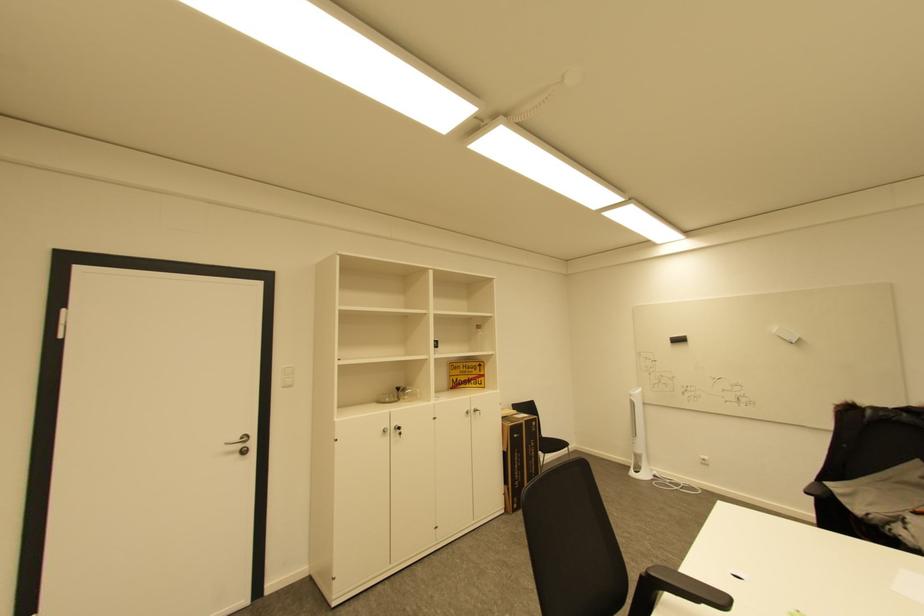
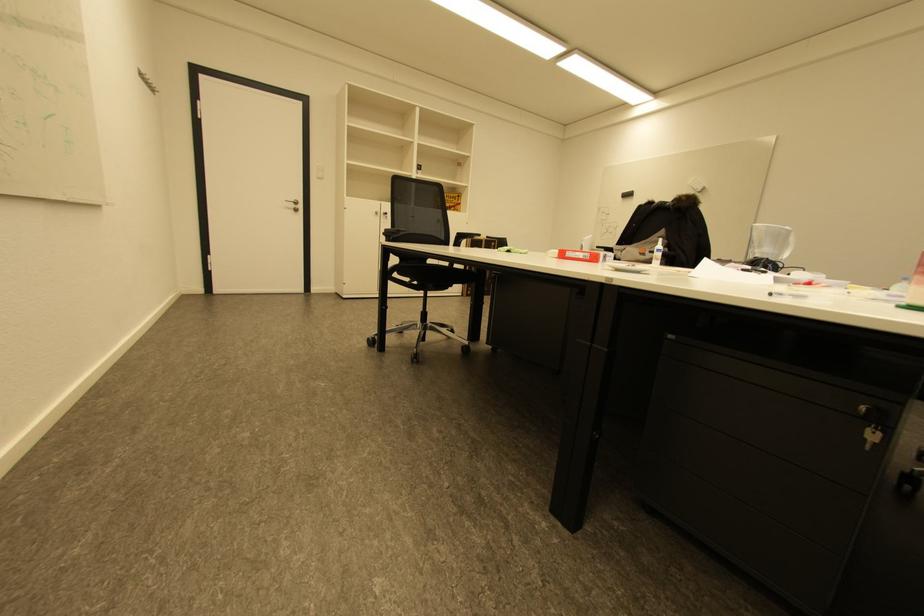
In a continuous first-person perspective shot, in which direction is the camera moving?

The cameraman moved toward right, backward.